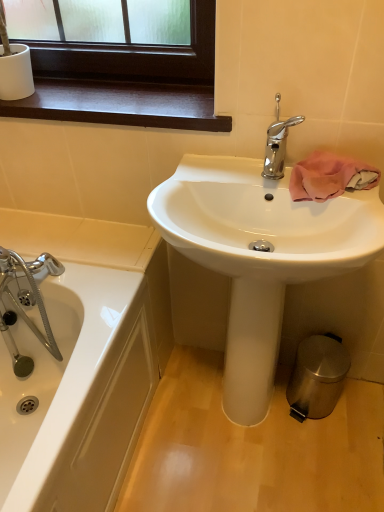
At what (x,y) coordinates should I click in order to perform the action: click on vacant area that lies in front of polished stainless steel trash can at lower right. Please return your answer as a coordinate pair (x, y). The image size is (384, 512). Looking at the image, I should click on (321, 451).